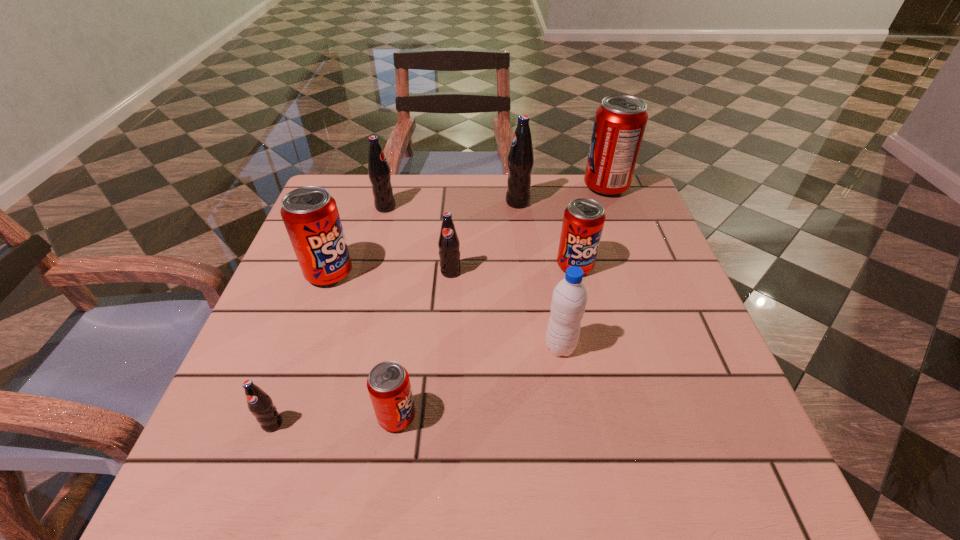
In order to click on the farthest red soda can in this screenshot , I will do `click(620, 121)`.

This screenshot has height=540, width=960. Find the location of `the rightmost red soda can`. the rightmost red soda can is located at coordinates (620, 121).

I want to click on the rightmost black pop, so click(x=520, y=160).

This screenshot has width=960, height=540. I want to click on the biggest black pop, so click(520, 160).

At what (x,y) coordinates should I click in order to perform the action: click on the third object from left to right. Please return your answer as a coordinate pair (x, y). The width and height of the screenshot is (960, 540). Looking at the image, I should click on (379, 173).

You are a GUI agent. You are given a task and a screenshot of the screen. Output one action in this format:
    pyautogui.click(x=<x>, y=<y>)
    Task: Click on the third soda can from left to right
    The width and height of the screenshot is (960, 540).
    Given the screenshot: What is the action you would take?
    pyautogui.click(x=379, y=173)

Locate an element on the screen. The image size is (960, 540). the leftmost red soda can is located at coordinates (310, 215).

I want to click on water bottle, so click(569, 299).

You are a GUI agent. You are given a task and a screenshot of the screen. Output one action in this format:
    pyautogui.click(x=<x>, y=<y>)
    Task: Click on the seventh farthest object
    
    Given the screenshot: What is the action you would take?
    pyautogui.click(x=569, y=299)

The image size is (960, 540). I want to click on the third farthest black pop, so click(x=448, y=243).